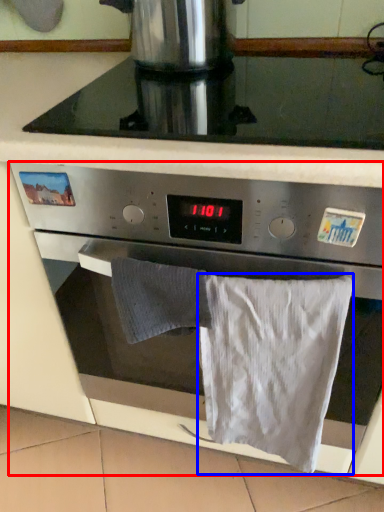
Question: Which of the following is the closest to the observer, oven (highlighted by a red box) or bath towel (highlighted by a blue box)?

Choices:
 (A) oven
 (B) bath towel

Answer: (A)